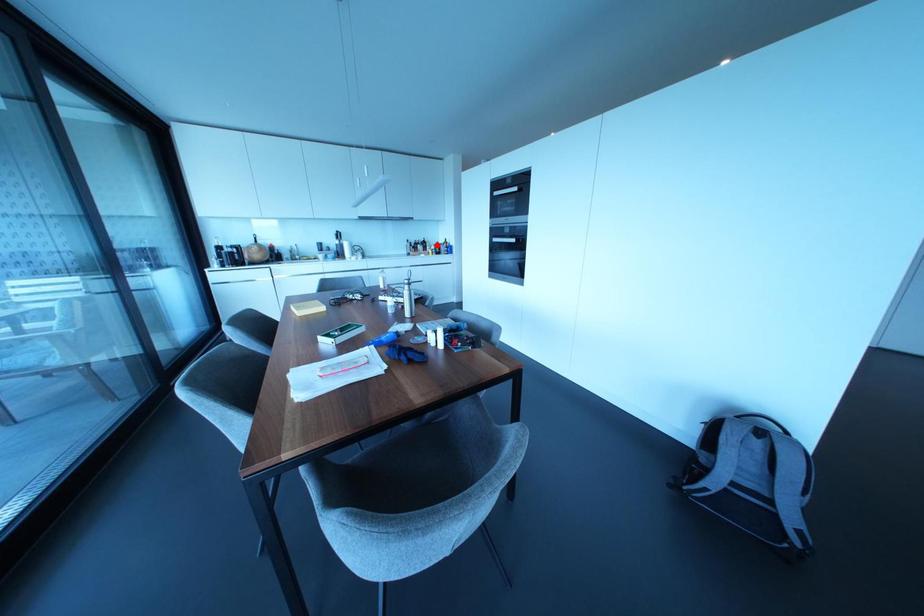
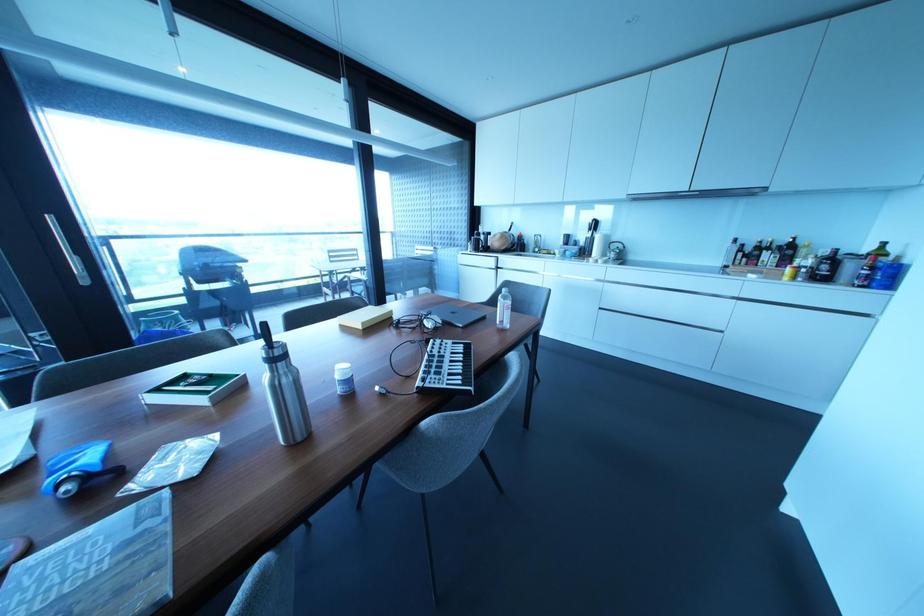
Question: I am providing you with two images of the same scene from different viewpoints. Given a red point in image1, look at the same physical point in image2. Is it:

Choices:
 (A) Closer to the viewpoint
 (B) Farther from the viewpoint

Answer: (B)